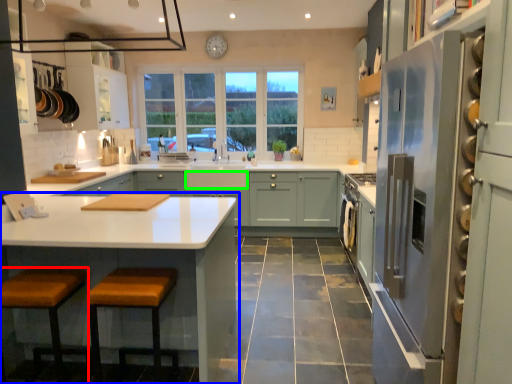
Question: Based on their relative distances, which object is farther from stool (highlighted by a red box)? Choose from cabinetry (highlighted by a blue box) and drawer (highlighted by a green box).

Choices:
 (A) cabinetry
 (B) drawer

Answer: (B)